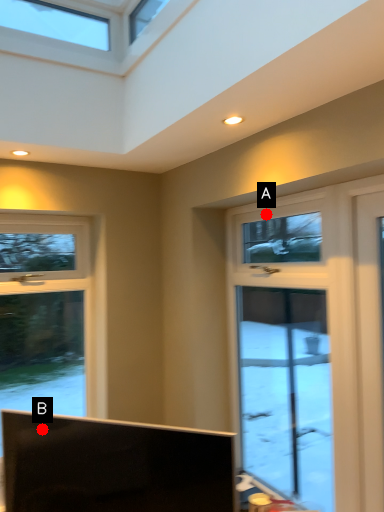
Question: Two points are circled on the image, labeled by A and B beside each circle. Which point is further to the camera?

Choices:
 (A) A is further
 (B) B is further

Answer: (A)